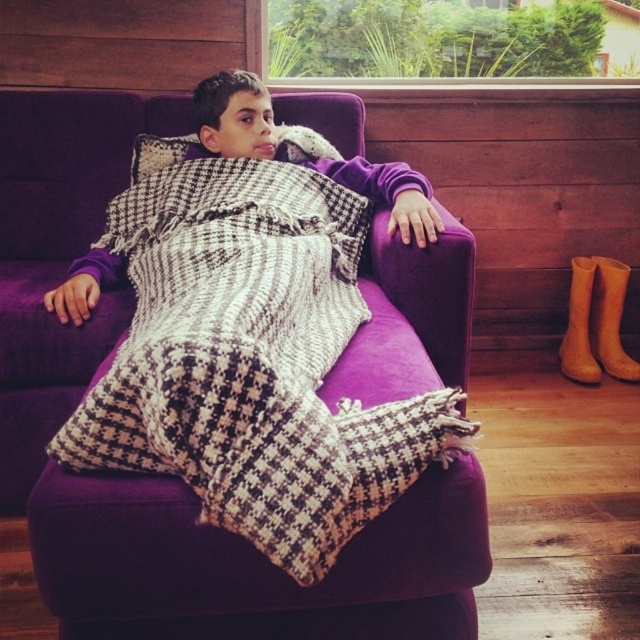
Question: Which object is the closest to the houndstooth fabric pillow at upper center?

Choices:
 (A) purple fabric armchair at center
 (B) brown leather boot at right

Answer: (A)

Question: Which is nearer to the purple fabric armchair at center?

Choices:
 (A) houndstooth fabric pillow at upper center
 (B) brown suede boot at lower right

Answer: (A)

Question: Can you confirm if brown suede boot at lower right is bigger than houndstooth fabric pillow at upper center?

Choices:
 (A) yes
 (B) no

Answer: (A)

Question: Which of the following is the farthest from the observer?

Choices:
 (A) (230, 584)
 (B) (570, 308)
 (C) (628, 275)
 (D) (138, 170)

Answer: (B)

Question: Is houndstooth fabric pillow at upper center positioned before brown leather boot at right?

Choices:
 (A) no
 (B) yes

Answer: (B)

Question: In this image, where is purple fabric armchair at center located relative to houndstooth fabric pillow at upper center?

Choices:
 (A) above
 (B) below

Answer: (B)